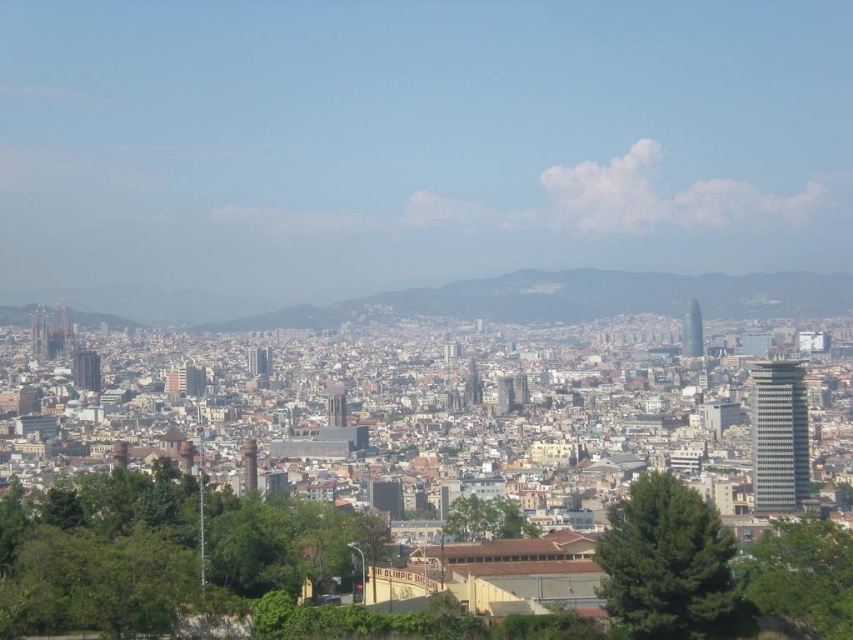
Question: Is green leafy tree at lower right to the left of green leafy tree at center from the viewer's perspective?

Choices:
 (A) yes
 (B) no

Answer: (B)

Question: Which object is closer to the camera taking this photo?

Choices:
 (A) green textured tree at center
 (B) green leafy tree at lower left

Answer: (B)

Question: Which point appears closest to the camera in this image?

Choices:
 (A) (624, 588)
 (B) (820, 577)

Answer: (A)

Question: Is green leafy tree at lower left wider than green leafy tree at center?

Choices:
 (A) no
 (B) yes

Answer: (B)

Question: Does green textured tree at center appear under green leafy tree at center?

Choices:
 (A) yes
 (B) no

Answer: (A)

Question: Which point is farther from the camera taking this photo?

Choices:
 (A) (108, 582)
 (B) (798, 529)
 (C) (692, 600)
 (D) (488, 516)

Answer: (B)